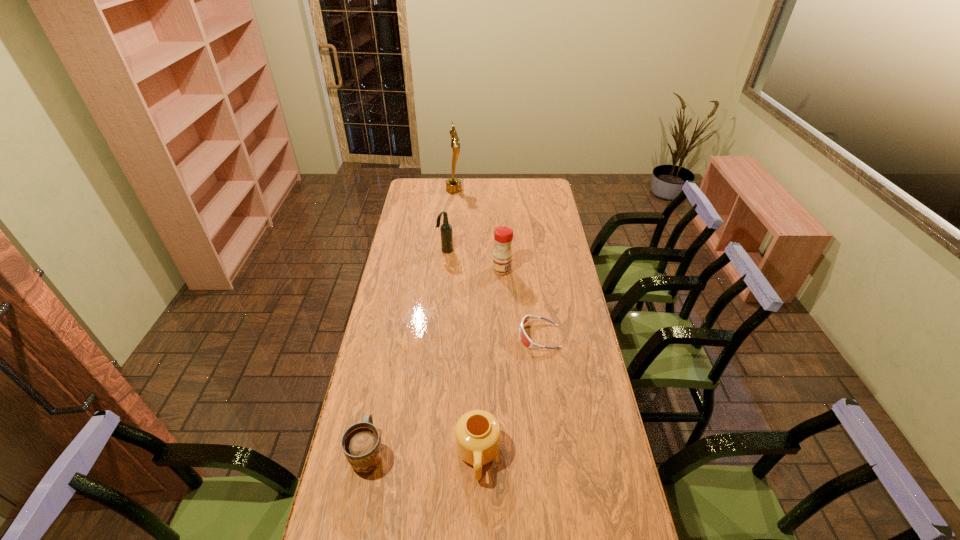
The image size is (960, 540). I want to click on free space located on the back of the second farthest object, so click(x=449, y=204).

I want to click on vacant space located on the handle side of the right mug, so click(x=478, y=504).

I want to click on free point located 0.280m on the side of the leftmost object with the handle, so click(x=387, y=358).

Find the location of a particular element. Image resolution: width=960 pixels, height=540 pixels. free space located 0.070m on the side of the leftmost object with the handle is located at coordinates (377, 409).

This screenshot has height=540, width=960. I want to click on free space located 0.070m on the side of the leftmost object with the handle, so click(x=377, y=409).

Locate an element on the screen. This screenshot has height=540, width=960. vacant space located on the front-facing side of the fourth farthest object is located at coordinates (442, 336).

The width and height of the screenshot is (960, 540). What are the coordinates of `free point located on the front-facing side of the fourth farthest object` in the screenshot? It's located at (416, 336).

The width and height of the screenshot is (960, 540). Find the location of `free spot located on the front-facing side of the fourth farthest object`. free spot located on the front-facing side of the fourth farthest object is located at coordinates (476, 336).

Identify the location of object at the far edge. (453, 185).

Identify the location of object that is at the left edge. This screenshot has height=540, width=960. (361, 444).